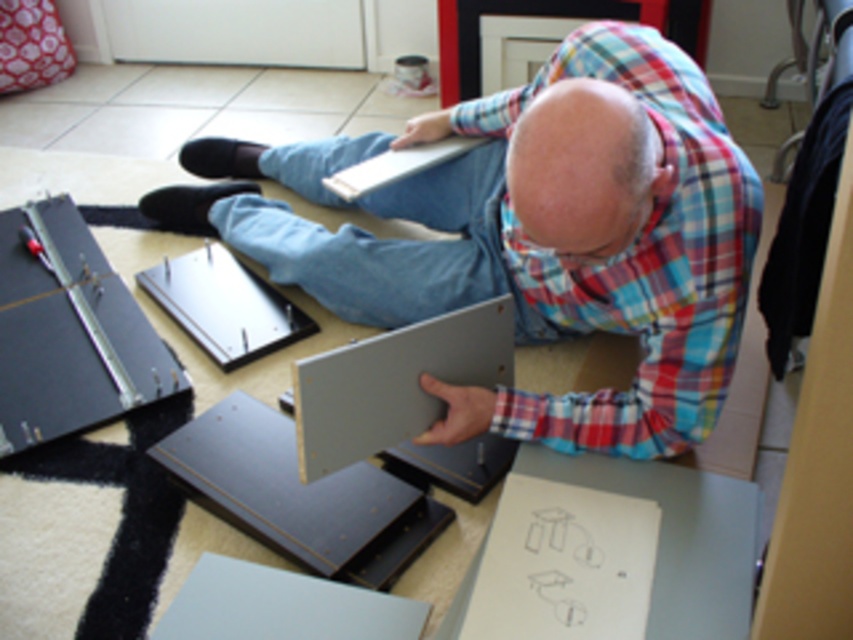
Question: Which point appears farthest from the camera in this image?

Choices:
 (A) (67, 308)
 (B) (378, 180)
 (C) (717, 353)

Answer: (A)

Question: Which point is farther to the camera?

Choices:
 (A) (183, 227)
 (B) (30, 390)

Answer: (A)

Question: Is metallic silver bracket at lower left further to the viewer compared to white matte laptop at center?

Choices:
 (A) yes
 (B) no

Answer: (B)

Question: Is metallic silver bracket at lower left positioned in front of white matte laptop at center?

Choices:
 (A) yes
 (B) no

Answer: (A)

Question: Which of these objects is positioned farthest from the metallic silver bracket at lower left?

Choices:
 (A) matte gray panel at center
 (B) white matte laptop at center

Answer: (B)

Question: Is metallic silver bracket at lower left above white matte laptop at center?

Choices:
 (A) yes
 (B) no

Answer: (B)